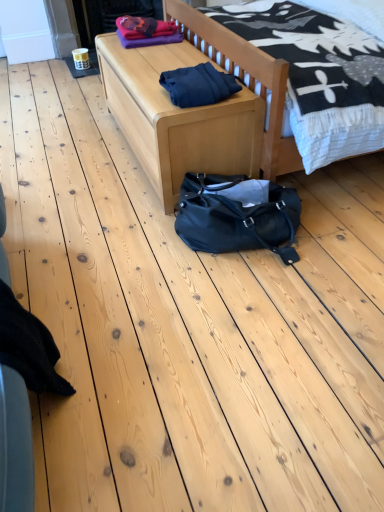
Question: Considering the relative sizes of light wood bed at center and light wood bench at center in the image provided, is light wood bed at center taller than light wood bench at center?

Choices:
 (A) no
 (B) yes

Answer: (B)

Question: From a real-world perspective, does light wood bed at center sit lower than light wood bench at center?

Choices:
 (A) no
 (B) yes

Answer: (A)

Question: Is light wood bed at center further to the viewer compared to light wood bench at center?

Choices:
 (A) yes
 (B) no

Answer: (B)

Question: Considering the relative sizes of light wood bed at center and light wood bench at center in the image provided, is light wood bed at center wider than light wood bench at center?

Choices:
 (A) yes
 (B) no

Answer: (A)

Question: Is light wood bed at center oriented towards light wood bench at center?

Choices:
 (A) yes
 (B) no

Answer: (A)

Question: In the image, is dark blue fabric at center positioned in front of or behind black fabric at lower left?

Choices:
 (A) behind
 (B) front

Answer: (A)

Question: Based on their positions, is dark blue fabric at center located to the left or right of black fabric at lower left?

Choices:
 (A) left
 (B) right

Answer: (B)

Question: Based on their sizes in the image, would you say dark blue fabric at center is bigger or smaller than black fabric at lower left?

Choices:
 (A) small
 (B) big

Answer: (A)

Question: From a real-world perspective, is dark blue fabric at center positioned above or below black fabric at lower left?

Choices:
 (A) above
 (B) below

Answer: (A)

Question: From their relative heights in the image, would you say dark blue fabric at center is taller or shorter than light wood bench at center?

Choices:
 (A) short
 (B) tall

Answer: (A)

Question: In terms of size, does dark blue fabric at center appear bigger or smaller than light wood bench at center?

Choices:
 (A) big
 (B) small

Answer: (B)

Question: From the image's perspective, is dark blue fabric at center above or below light wood bench at center?

Choices:
 (A) above
 (B) below

Answer: (B)

Question: Considering the positions of point (175, 100) and point (162, 114), is point (175, 100) closer or farther from the camera than point (162, 114)?

Choices:
 (A) closer
 (B) farther

Answer: (B)

Question: Considering the positions of point (208, 99) and point (281, 96), is point (208, 99) closer or farther from the camera than point (281, 96)?

Choices:
 (A) farther
 (B) closer

Answer: (B)

Question: Is dark blue fabric at center to the left or to the right of light wood bed at center in the image?

Choices:
 (A) right
 (B) left

Answer: (B)